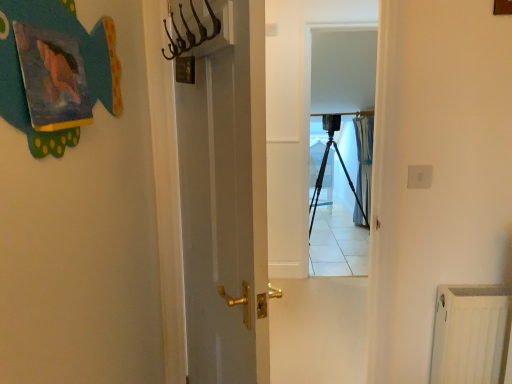
Question: Does white glossy screen door at center, the 1th screen door in the front-to-back sequence, lie behind black matte tripod at center?

Choices:
 (A) no
 (B) yes

Answer: (A)

Question: Does white glossy screen door at center, acting as the first screen door starting from the left, contain black matte tripod at center?

Choices:
 (A) no
 (B) yes

Answer: (A)

Question: Is white glossy screen door at center, acting as the first screen door starting from the left, facing towards black matte tripod at center?

Choices:
 (A) no
 (B) yes

Answer: (A)

Question: Are white glossy screen door at center, which is the 2th screen door from right to left, and black matte tripod at center making contact?

Choices:
 (A) yes
 (B) no

Answer: (B)

Question: Is black matte tripod at center at the back of white glossy screen door at center, the second screen door viewed from the back?

Choices:
 (A) yes
 (B) no

Answer: (A)

Question: Does white glossy screen door at center, the second screen door viewed from the back, have a larger size compared to black matte tripod at center?

Choices:
 (A) no
 (B) yes

Answer: (A)

Question: Does black matte tripod at center have a greater width compared to white textured radiator at lower right?

Choices:
 (A) yes
 (B) no

Answer: (A)

Question: From a real-world perspective, is black matte tripod at center physically below white textured radiator at lower right?

Choices:
 (A) yes
 (B) no

Answer: (B)

Question: From the image's perspective, would you say black matte tripod at center is positioned over white textured radiator at lower right?

Choices:
 (A) no
 (B) yes

Answer: (B)

Question: From the image's perspective, is black matte tripod at center beneath white textured radiator at lower right?

Choices:
 (A) yes
 (B) no

Answer: (B)

Question: Is white textured radiator at lower right at the back of black matte tripod at center?

Choices:
 (A) yes
 (B) no

Answer: (B)

Question: Is black matte tripod at center facing towards white textured radiator at lower right?

Choices:
 (A) yes
 (B) no

Answer: (A)

Question: Is blue sheer curtain at center shorter than black matte tripod at center?

Choices:
 (A) yes
 (B) no

Answer: (B)